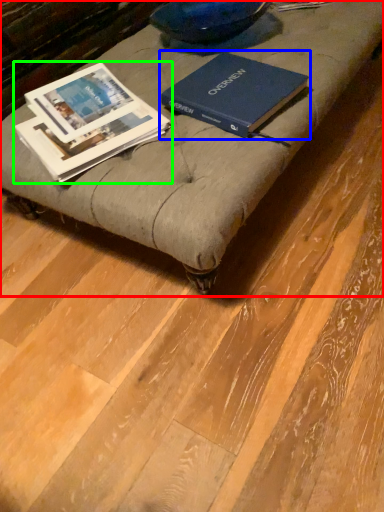
Question: Which object is positioned farthest from furniture (highlighted by a red box)? Select from book (highlighted by a blue box) and book (highlighted by a green box).

Choices:
 (A) book
 (B) book

Answer: (B)